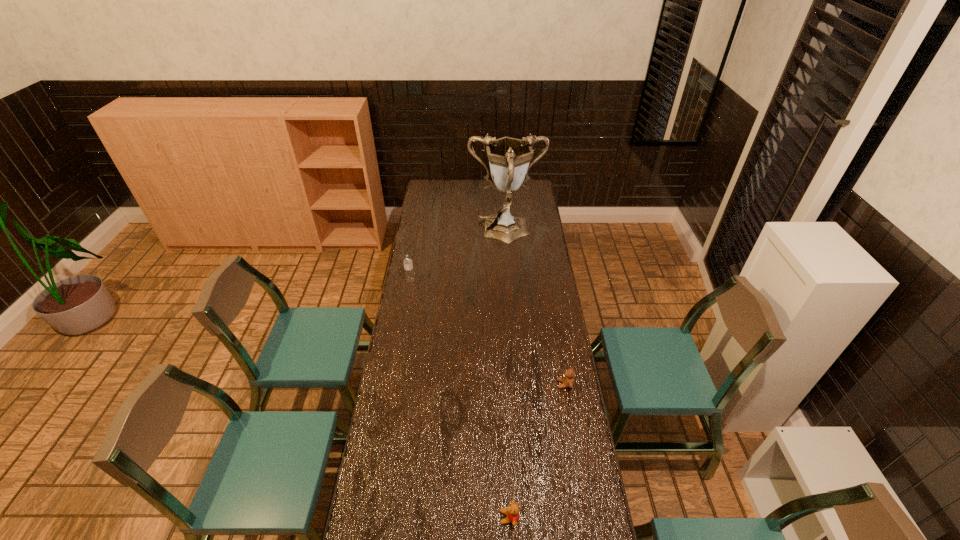
The image size is (960, 540). In order to click on vacant space that's between the water bottle and the farther teddy bear in this screenshot , I will do `click(488, 333)`.

Image resolution: width=960 pixels, height=540 pixels. What are the coordinates of `unoccupied area between the second nearest object and the water bottle` in the screenshot? It's located at (488, 333).

This screenshot has height=540, width=960. Identify the location of unoccupied position between the right teddy bear and the nearest object. (537, 451).

Locate an element on the screen. object that is the second closest to the second nearest object is located at coordinates (510, 159).

Point out which object is positioned as the nearest to the third shortest object. Please provide its 2D coordinates. Your answer should be formatted as a tuple, i.e. [(x, y)], where the tuple contains the x and y coordinates of a point satisfying the conditions above.

[(510, 159)]